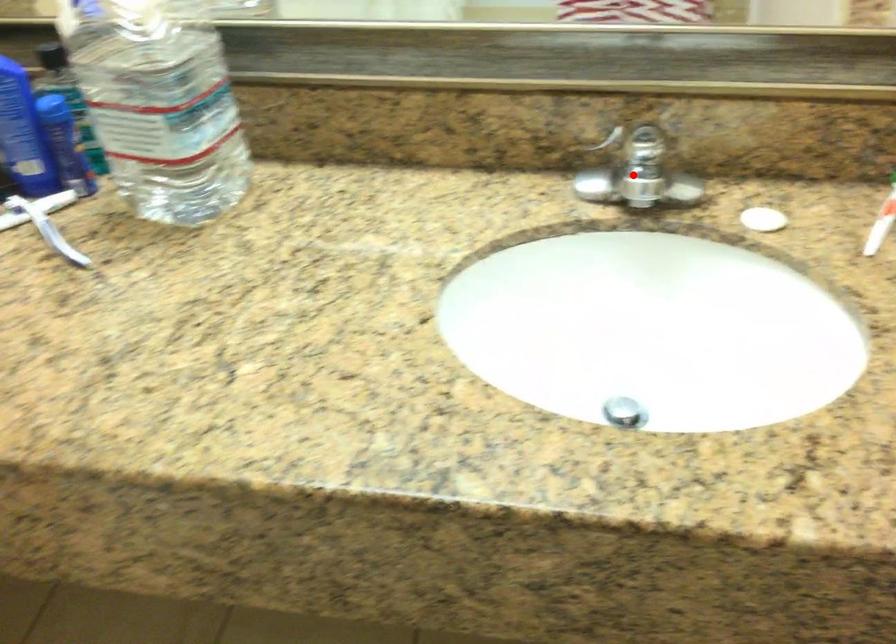
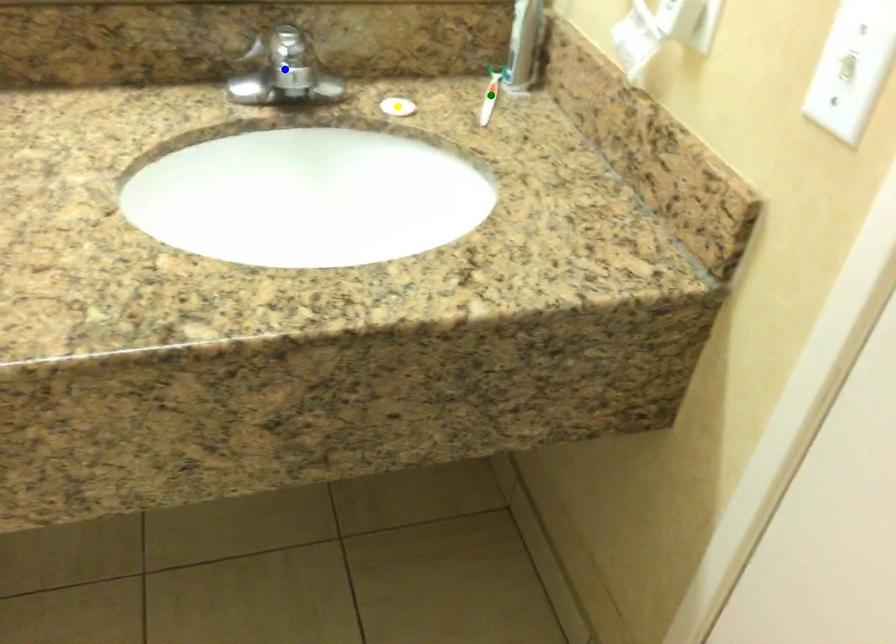
Question: I am providing you with two images of the same scene from different viewpoints. A red point is marked on the first image. You are given multiple points on the second image. Which spot in image 2 lines up with the point in image 1?

Choices:
 (A) green point
 (B) yellow point
 (C) blue point

Answer: (C)